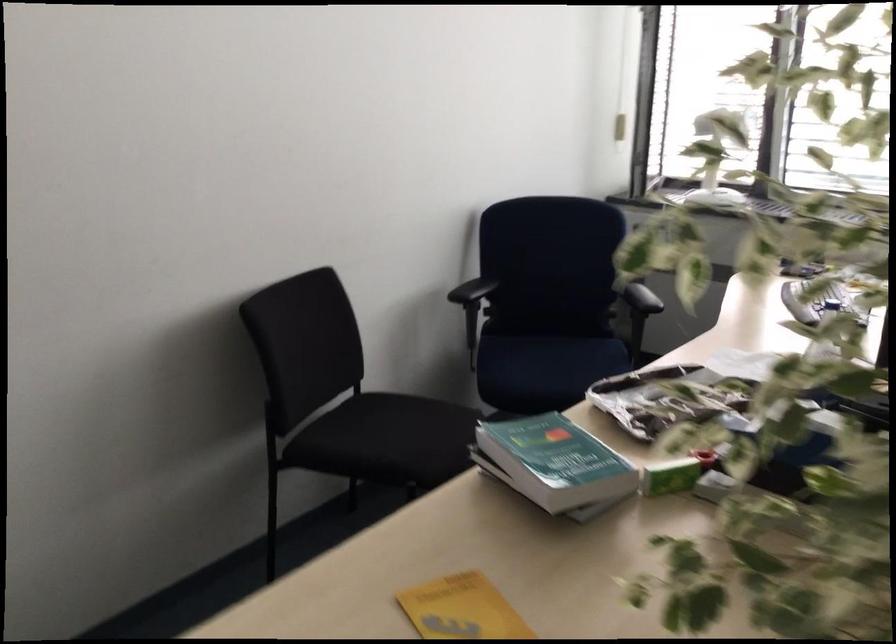
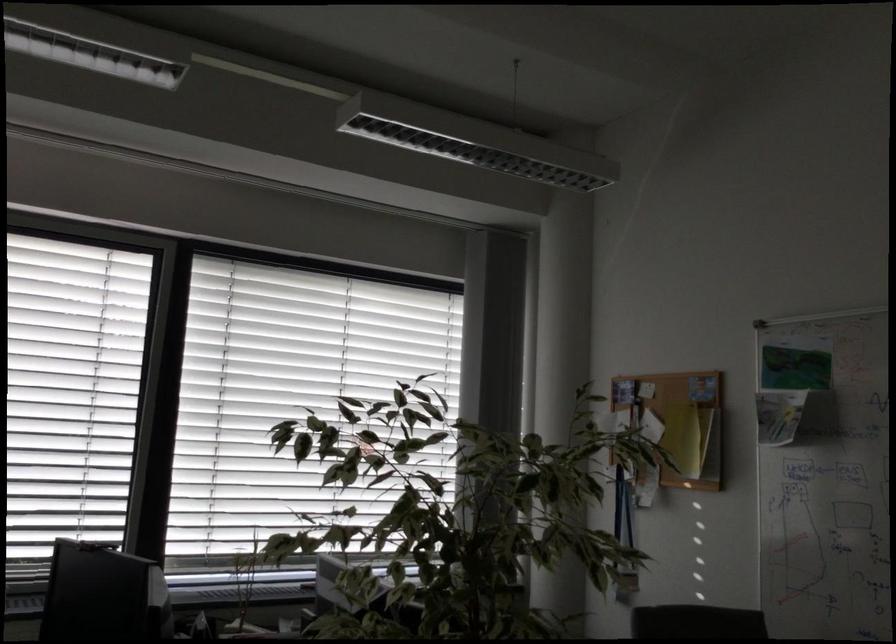
Consider the image. How did the camera likely rotate?

The camera's rotation is toward right-up.